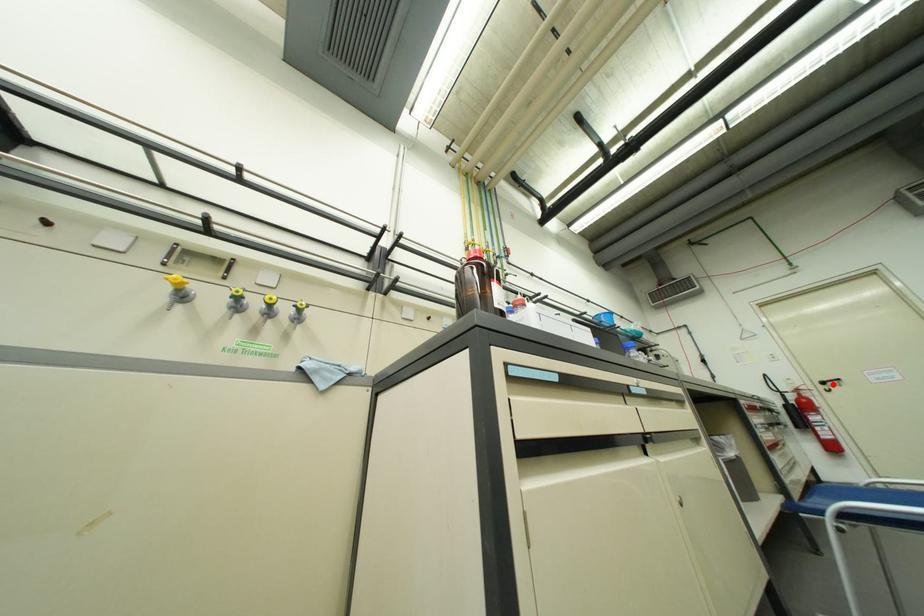
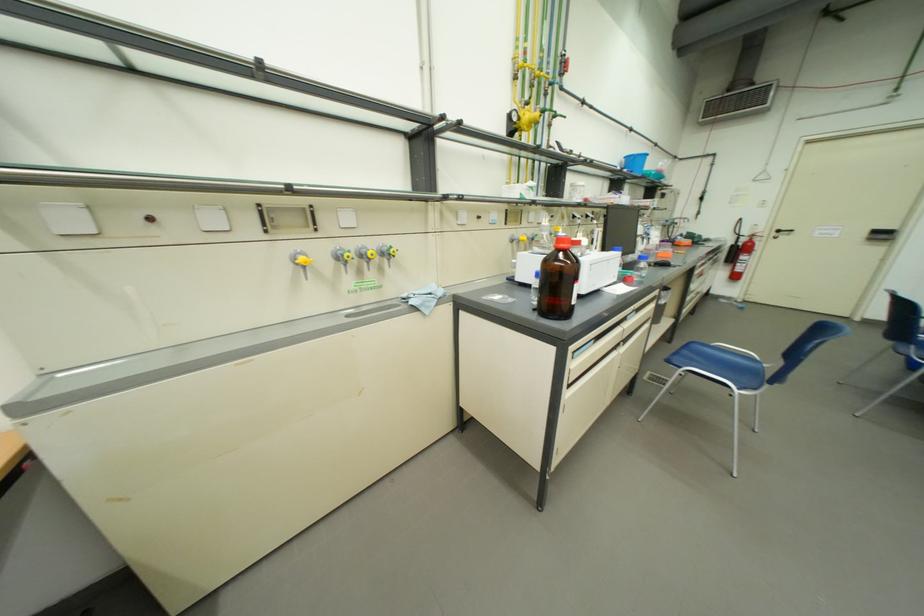
Find the pixel in the second image that matches the highlighted location in the first image.

(787, 233)